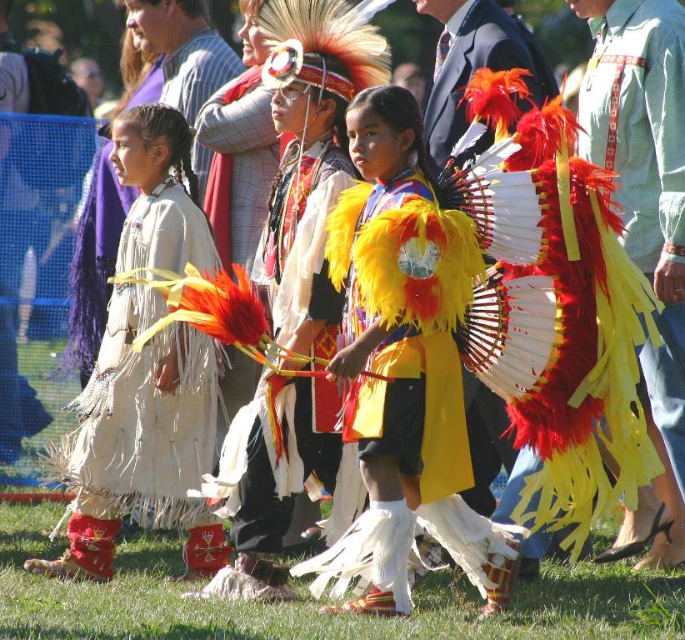
Between yellow fabric headdress at center and yellow feather headdress at center, which one is positioned lower?

yellow fabric headdress at center

Can you confirm if yellow fabric headdress at center is thinner than yellow feather headdress at center?

Correct, yellow fabric headdress at center's width is less than yellow feather headdress at center's.

Image resolution: width=685 pixels, height=640 pixels. Identify the location of yellow fabric headdress at center. (645, 221).

Is point (162, 252) positioned behind point (621, 54)?

Yes, point (162, 252) is farther from viewer.

Describe the element at coordinates (140, 440) in the screenshot. This screenshot has width=685, height=640. I see `beige fringe dress at center` at that location.

Identify the location of beige fringe dress at center. (140, 440).

Does feathered yellow dress at center appear under yellow feather headdress at center?

Yes, feathered yellow dress at center is below yellow feather headdress at center.

The height and width of the screenshot is (640, 685). Describe the element at coordinates (301, 244) in the screenshot. I see `feathered yellow dress at center` at that location.

Does point (279, 520) come in front of point (480, 385)?

Yes, point (279, 520) is in front of point (480, 385).

This screenshot has width=685, height=640. I want to click on feathered yellow dress at center, so click(x=301, y=244).